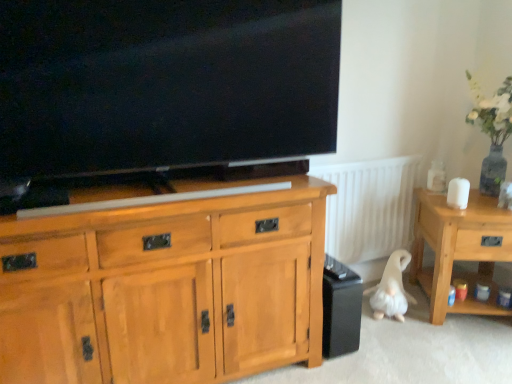
Locate an element on the screen. This screenshot has height=384, width=512. vacant area to the right of white plush dog at lower right is located at coordinates (x=426, y=312).